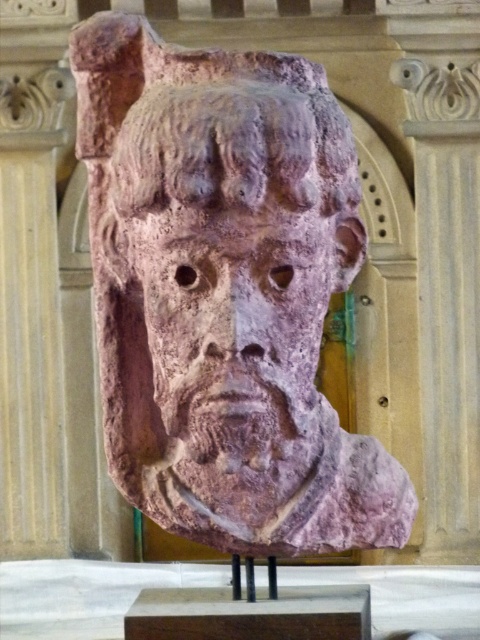
How far apart are rustic stone mask at center and rustic stone face at center?

rustic stone mask at center and rustic stone face at center are 3.55 centimeters apart.

Who is positioned more to the right, rustic stone mask at center or rustic stone face at center?

From the viewer's perspective, rustic stone face at center appears more on the right side.

Who is more distant from viewer, (225, 324) or (249, 237)?

The point (249, 237) is more distant.

Locate an element on the screen. rustic stone mask at center is located at coordinates (225, 292).